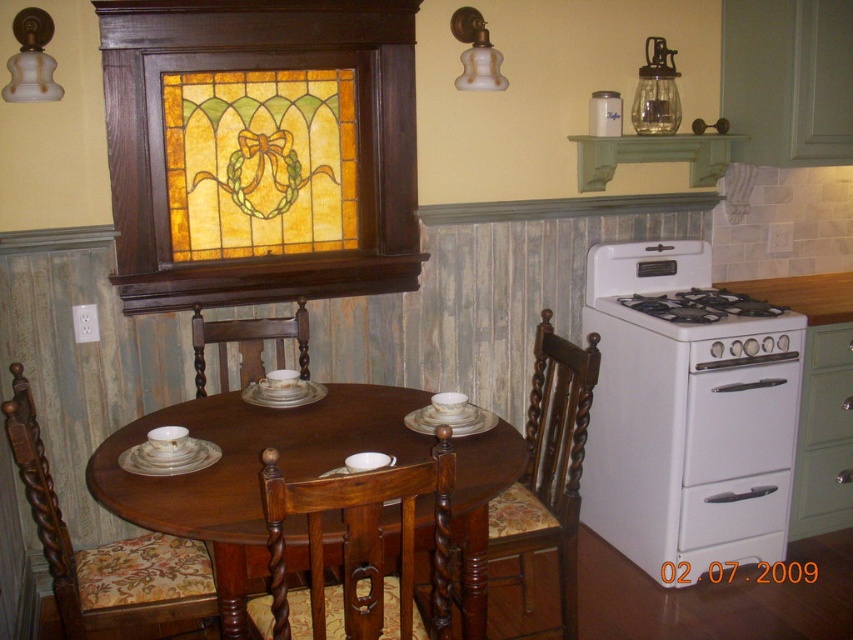
What do you see at coordinates (543, 497) in the screenshot?
I see `wooden chair with floral cushion at lower center` at bounding box center [543, 497].

Is wooden chair with floral cushion at lower center smaller than floral fabric cushioned chair at center?

Actually, wooden chair with floral cushion at lower center might be larger than floral fabric cushioned chair at center.

This screenshot has width=853, height=640. Identify the location of wooden chair with floral cushion at lower center. tap(543, 497).

Is white matte oven at right to the right of white glossy drawer at lower right from the viewer's perspective?

In fact, white matte oven at right is to the left of white glossy drawer at lower right.

Does point (762, 496) come farther from viewer compared to point (767, 525)?

That is False.

Is point (612, 342) positioned in front of point (727, 483)?

That is False.

Find the location of a particular element. The image size is (853, 640). white matte oven at right is located at coordinates [x=686, y=419].

Can you confirm if translucent stained glass at upper center is positioned to the left of white glossy gas stove at right?

Indeed, translucent stained glass at upper center is positioned on the left side of white glossy gas stove at right.

Who is positioned more to the left, translucent stained glass at upper center or white glossy gas stove at right?

From the viewer's perspective, translucent stained glass at upper center appears more on the left side.

Between point (331, 115) and point (651, 316), which one is positioned behind?

The point (331, 115) is behind.

Locate an element on the screen. The image size is (853, 640). translucent stained glass at upper center is located at coordinates click(x=260, y=163).